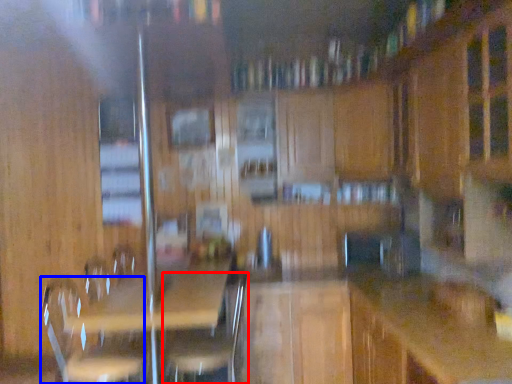
Question: Which object is further to the camera taking this photo, swivel chair (highlighted by a red box) or swivel chair (highlighted by a blue box)?

Choices:
 (A) swivel chair
 (B) swivel chair

Answer: (A)